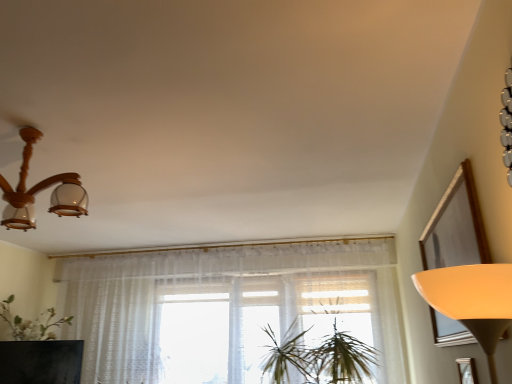
Question: Is point (94, 274) closer or farther from the camera than point (69, 192)?

Choices:
 (A) farther
 (B) closer

Answer: (A)

Question: Is sheer white curtain at center bigger or smaller than wooden chandelier at upper left?

Choices:
 (A) big
 (B) small

Answer: (A)

Question: Estimate the real-world distances between objects in this image. Which object is farther from the green leafy plant at center?

Choices:
 (A) sheer white curtain at center
 (B) wooden chandelier at upper left
 (C) matte black tv at lower left
 (D) wooden picture frame at lower right

Answer: (C)

Question: Which of these objects is positioned closest to the wooden chandelier at upper left?

Choices:
 (A) green leafy plant at center
 (B) sheer white curtain at center
 (C) matte black tv at lower left
 (D) wooden picture frame at lower right

Answer: (C)